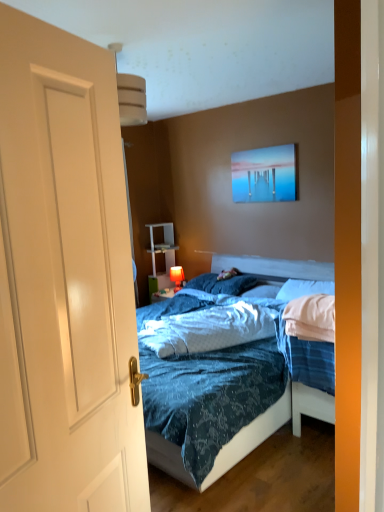
What is the approximate height of white soft pillow at center, marked as the second pillow in a left-to-right arrangement?

4.09 inches.

What do you see at coordinates (161, 253) in the screenshot? I see `white glossy shelf at center` at bounding box center [161, 253].

The width and height of the screenshot is (384, 512). Identify the location of metallic glossy picture frame at upper center. (265, 174).

Measure the distance between matte red lamp at center and camera.

A distance of 4.47 meters exists between matte red lamp at center and camera.

This screenshot has height=512, width=384. Describe the element at coordinates (177, 277) in the screenshot. I see `matte red lamp at center` at that location.

This screenshot has width=384, height=512. What are the coordinates of `white soft pillow at center, marked as the second pillow in a left-to-right arrangement` in the screenshot? It's located at (264, 290).

Considering the sizes of objects white glossy door at center and white soft pillow at center, acting as the 1th pillow starting from the right, in the image provided, who is thinner, white glossy door at center or white soft pillow at center, acting as the 1th pillow starting from the right,?

white glossy door at center.

From the image's perspective, which one is positioned lower, white glossy door at center or white soft pillow at center, placed as the 3th pillow when sorted from left to right?

white soft pillow at center, placed as the 3th pillow when sorted from left to right, appears lower in the image.

Is white glossy door at center directly adjacent to white soft pillow at center, acting as the 1th pillow starting from the right?

No, white glossy door at center is not with white soft pillow at center, acting as the 1th pillow starting from the right.

From the image's perspective, is metallic glossy picture frame at upper center over blue soft pillow at center, the third pillow from the right?

Yes, from the image's perspective, metallic glossy picture frame at upper center is above blue soft pillow at center, the third pillow from the right.

How different are the orientations of metallic glossy picture frame at upper center and blue soft pillow at center, the first pillow positioned from the left, in degrees?

The angular difference between metallic glossy picture frame at upper center and blue soft pillow at center, the first pillow positioned from the left, is 0.546 degrees.

The width and height of the screenshot is (384, 512). Find the location of `the 2nd pillow located beneath the metallic glossy picture frame at upper center (from a real-world perspective)`. the 2nd pillow located beneath the metallic glossy picture frame at upper center (from a real-world perspective) is located at coordinates (222, 284).

Is matte red lamp at center facing away from blue soft pillow at center, the third pillow from the right?

No, blue soft pillow at center, the third pillow from the right, is not at the back of matte red lamp at center.

Is matte red lamp at center positioned beyond the bounds of blue soft pillow at center, the third pillow from the right?

matte red lamp at center lies outside blue soft pillow at center, the third pillow from the right,'s area.

In the scene shown: Can you confirm if matte red lamp at center is taller than blue soft pillow at center, the third pillow from the right?

Yes, matte red lamp at center is taller than blue soft pillow at center, the third pillow from the right.

In the image, is white soft pillow at center, marked as the second pillow in a left-to-right arrangement, positioned in front of or behind matte red lamp at center?

white soft pillow at center, marked as the second pillow in a left-to-right arrangement, is in front of matte red lamp at center.

Between white soft pillow at center, the 2th pillow when ordered from right to left, and matte red lamp at center, which one has larger size?

With larger size is white soft pillow at center, the 2th pillow when ordered from right to left.

Could you tell me if white soft pillow at center, the 2th pillow when ordered from right to left, is turned towards matte red lamp at center?

No.

Considering the relative sizes of white soft pillow at center, the 2th pillow when ordered from right to left, and matte red lamp at center in the image provided, is white soft pillow at center, the 2th pillow when ordered from right to left, taller than matte red lamp at center?

No.

Considering the relative sizes of white soft pillow at center, marked as the second pillow in a left-to-right arrangement, and white glossy door at center in the image provided, is white soft pillow at center, marked as the second pillow in a left-to-right arrangement, smaller than white glossy door at center?

Indeed, white soft pillow at center, marked as the second pillow in a left-to-right arrangement, has a smaller size compared to white glossy door at center.

Is white soft pillow at center, marked as the second pillow in a left-to-right arrangement, in front of or behind white glossy door at center in the image?

white soft pillow at center, marked as the second pillow in a left-to-right arrangement, is behind white glossy door at center.

Are white soft pillow at center, the 2th pillow when ordered from right to left, and white glossy door at center beside each other?

No, white soft pillow at center, the 2th pillow when ordered from right to left, is not making contact with white glossy door at center.

Measure the distance between white soft pillow at center, placed as the 3th pillow when sorted from left to right, and white glossy shelf at center.

white soft pillow at center, placed as the 3th pillow when sorted from left to right, and white glossy shelf at center are 5.05 feet apart.

How different are the orientations of white soft pillow at center, acting as the 1th pillow starting from the right, and white glossy shelf at center in degrees?

They differ by 0.0201 degrees in their facing directions.

Between white soft pillow at center, acting as the 1th pillow starting from the right, and white glossy shelf at center, which one has smaller size?

Smaller between the two is white soft pillow at center, acting as the 1th pillow starting from the right.

Is white soft pillow at center, acting as the 1th pillow starting from the right, far from white glossy shelf at center?

white soft pillow at center, acting as the 1th pillow starting from the right, is far away from white glossy shelf at center.

Between blue soft pillow at center, the third pillow from the right, and matte red lamp at center, which one has smaller width?

With smaller width is matte red lamp at center.

From the image's perspective, is blue soft pillow at center, the first pillow positioned from the left, above or below matte red lamp at center?

blue soft pillow at center, the first pillow positioned from the left, is above matte red lamp at center.

Between blue soft pillow at center, the third pillow from the right, and matte red lamp at center, which one has smaller size?

matte red lamp at center.

Who is taller, blue soft pillow at center, the third pillow from the right, or matte red lamp at center?

matte red lamp at center is taller.

There is a white glossy door at center. Where is `the 1st pillow below it (from a real-world perspective)`? the 1st pillow below it (from a real-world perspective) is located at coordinates (304, 289).

The height and width of the screenshot is (512, 384). I want to click on picture frame that appears on the right of blue soft pillow at center, the first pillow positioned from the left, so click(265, 174).

Based on their spatial positions, is matte red lamp at center or white glossy door at center closer to metallic glossy picture frame at upper center?

matte red lamp at center lies closer to metallic glossy picture frame at upper center than the other object.

Which object lies further to the anchor point metallic glossy picture frame at upper center, white soft pillow at center, placed as the 3th pillow when sorted from left to right, or white glossy shelf at center?

white glossy shelf at center lies further to metallic glossy picture frame at upper center than the other object.

In the scene shown: Estimate the real-world distances between objects in this image. Which object is closer to white soft pillow at center, acting as the 1th pillow starting from the right, white glossy shelf at center or metallic glossy picture frame at upper center?

metallic glossy picture frame at upper center is closer to white soft pillow at center, acting as the 1th pillow starting from the right.

Which object lies further to the anchor point blue soft pillow at center, the first pillow positioned from the left, white glossy shelf at center or white soft pillow at center, marked as the second pillow in a left-to-right arrangement?

Among the two, white glossy shelf at center is located further to blue soft pillow at center, the first pillow positioned from the left.

Which object lies further to the anchor point matte red lamp at center, white glossy door at center or blue soft pillow at center, the first pillow positioned from the left?

white glossy door at center is further to matte red lamp at center.

From the image, which object appears to be nearer to metallic glossy picture frame at upper center, white soft pillow at center, the 2th pillow when ordered from right to left, or white soft pillow at center, placed as the 3th pillow when sorted from left to right?

white soft pillow at center, placed as the 3th pillow when sorted from left to right, lies closer to metallic glossy picture frame at upper center than the other object.

Which object lies nearer to the anchor point white glossy shelf at center, white glossy door at center or blue soft pillow at center, the first pillow positioned from the left?

blue soft pillow at center, the first pillow positioned from the left, lies closer to white glossy shelf at center than the other object.

Which object lies further to the anchor point white soft pillow at center, acting as the 1th pillow starting from the right, white glossy door at center or white soft pillow at center, the 2th pillow when ordered from right to left?

Based on the image, white glossy door at center appears to be further to white soft pillow at center, acting as the 1th pillow starting from the right.

Locate an element on the screen. The image size is (384, 512). pillow between white soft pillow at center, marked as the second pillow in a left-to-right arrangement, and matte red lamp at center in the front-back direction is located at coordinates (222, 284).

Locate an element on the screen. pillow between blue soft pillow at center, the first pillow positioned from the left, and white soft pillow at center, placed as the 3th pillow when sorted from left to right is located at coordinates click(264, 290).

You are a GUI agent. You are given a task and a screenshot of the screen. Output one action in this format:
    pyautogui.click(x=<x>, y=<y>)
    Task: Click on the lamp between white soft pillow at center, placed as the 3th pillow when sorted from left to right, and white glossy shelf at center from front to back
    This screenshot has height=512, width=384.
    Given the screenshot: What is the action you would take?
    pyautogui.click(x=177, y=277)

Locate an element on the screen. picture frame between white soft pillow at center, acting as the 1th pillow starting from the right, and white glossy shelf at center in the front-back direction is located at coordinates (265, 174).